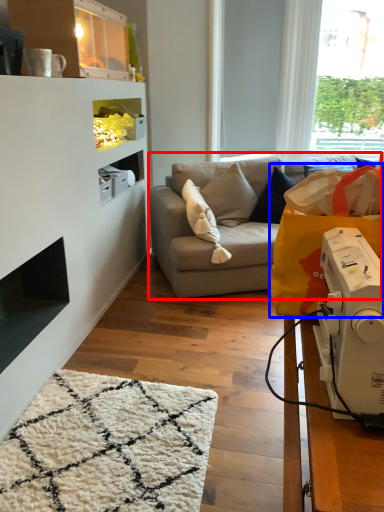
Question: Which object appears farthest to the camera in this image, studio couch (highlighted by a red box) or grocery bag (highlighted by a blue box)?

Choices:
 (A) studio couch
 (B) grocery bag

Answer: (A)